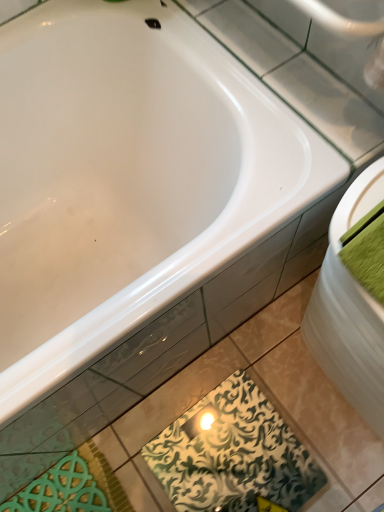
In order to face white glossy sink at right, should I rotate leftwards or rightwards?

Turn right approximately 26.398 degrees to face it.

Where is `white glossy sink at right`? white glossy sink at right is located at coordinates (350, 311).

What is the approximate width of green patterned tile at lower center?

green patterned tile at lower center is 12.32 inches in width.

At what (x,y) coordinates should I click in order to perform the action: click on green fabric towel at right. Please return your answer as a coordinate pair (x, y). Image resolution: width=384 pixels, height=512 pixels. Looking at the image, I should click on (366, 251).

What do you see at coordinates (366, 251) in the screenshot? The height and width of the screenshot is (512, 384). I see `green fabric towel at right` at bounding box center [366, 251].

This screenshot has width=384, height=512. Identify the location of white glossy sink at right. (350, 311).

Which of these two, white glossy sink at right or green fabric towel at right, stands taller?

white glossy sink at right is taller.

Would you say white glossy sink at right is a long distance from green fabric towel at right?

No, there isn't a large distance between white glossy sink at right and green fabric towel at right.

Who is bigger, white glossy sink at right or green fabric towel at right?

With larger size is white glossy sink at right.

Does white glossy sink at right have a lesser width compared to green fabric towel at right?

Correct, the width of white glossy sink at right is less than that of green fabric towel at right.

Considering the relative positions of white glossy sink at right and green patterned tile at lower center in the image provided, is white glossy sink at right to the right of green patterned tile at lower center from the viewer's perspective?

Indeed, white glossy sink at right is positioned on the right side of green patterned tile at lower center.

Which of these two, white glossy sink at right or green patterned tile at lower center, is thinner?

Thinner between the two is white glossy sink at right.

What are the coordinates of `design below the white glossy sink at right (from a real-world perspective)` in the screenshot? It's located at (233, 454).

Which of these two, green fabric towel at right or green patterned tile at lower center, stands shorter?

green patterned tile at lower center is shorter.

In the image, is green fabric towel at right positioned in front of or behind green patterned tile at lower center?

green fabric towel at right is positioned closer to the viewer than green patterned tile at lower center.

Measure the distance between green fabric towel at right and green patterned tile at lower center.

green fabric towel at right is 23.99 inches away from green patterned tile at lower center.

How many degrees apart are the facing directions of green fabric towel at right and green patterned tile at lower center?

The angular difference between green fabric towel at right and green patterned tile at lower center is 91.7 degrees.

Is green fabric towel at right beside white glossy sink at right?

green fabric towel at right is not next to white glossy sink at right, and they're not touching.

Does green fabric towel at right have a greater height compared to white glossy sink at right?

In fact, green fabric towel at right may be shorter than white glossy sink at right.

Is green fabric towel at right oriented towards white glossy sink at right?

No, green fabric towel at right is not oriented towards white glossy sink at right.

Can you confirm if green fabric towel at right is wider than white glossy sink at right?

Yes.

Does point (271, 435) come behind point (363, 257)?

Yes, point (271, 435) is farther from viewer.

Which is correct: green patterned tile at lower center is inside green fabric towel at right, or outside of it?

green patterned tile at lower center is located beyond the bounds of green fabric towel at right.

Does green patterned tile at lower center come behind green fabric towel at right?

Yes.

From the image's perspective, does green patterned tile at lower center appear higher than white glossy sink at right?

No, from the image's perspective, green patterned tile at lower center is not over white glossy sink at right.

Which object is closer to the camera, green patterned tile at lower center or white glossy sink at right?

Positioned in front is white glossy sink at right.

Could you tell me if green patterned tile at lower center is turned towards white glossy sink at right?

No, green patterned tile at lower center does not turn towards white glossy sink at right.

This screenshot has width=384, height=512. Find the location of `sink below the green fabric towel at right (from the image's perspective)`. sink below the green fabric towel at right (from the image's perspective) is located at coordinates 350,311.

This screenshot has width=384, height=512. I want to click on design beneath the white glossy sink at right (from a real-world perspective), so click(x=233, y=454).

Looking at the image, which one is located further to white glossy sink at right, green fabric towel at right or green patterned tile at lower center?

The object further to white glossy sink at right is green patterned tile at lower center.

From the image, which object appears to be nearer to green fabric towel at right, green patterned tile at lower center or white glossy sink at right?

white glossy sink at right lies closer to green fabric towel at right than the other object.

Considering their positions, is white glossy sink at right positioned further to green fabric towel at right than green patterned tile at lower center?

green patterned tile at lower center is further to green fabric towel at right.

Looking at the image, which one is located further to white glossy sink at right, green patterned tile at lower center or green fabric towel at right?

green patterned tile at lower center lies further to white glossy sink at right than the other object.

Looking at this image, estimate the real-world distances between objects in this image. Which object is further from green patterned tile at lower center, green fabric towel at right or white glossy sink at right?

green fabric towel at right lies further to green patterned tile at lower center than the other object.

When comparing their distances from green patterned tile at lower center, does white glossy sink at right or green fabric towel at right seem further?

green fabric towel at right is further to green patterned tile at lower center.

The image size is (384, 512). Identify the location of sink between green fabric towel at right and green patterned tile at lower center along the z-axis. (350, 311).